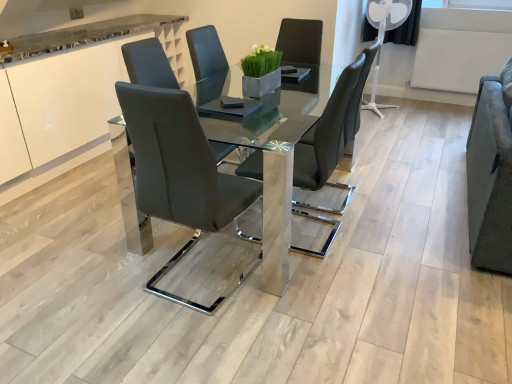
Question: Which is correct: white glossy cabinet at upper left is inside matte black chair at center, placed as the 1th chair when sorted from right to left, or outside of it?

Choices:
 (A) outside
 (B) inside

Answer: (A)

Question: In terms of width, does white glossy cabinet at upper left look wider or thinner when compared to matte black chair at center, which is the 2th chair from left to right?

Choices:
 (A) wide
 (B) thin

Answer: (A)

Question: Which is nearer to the matte black chair at center, placed as the 1th chair when sorted from right to left?

Choices:
 (A) white glossy cabinet at upper left
 (B) matte black chair at center, the 2th chair viewed from the right
 (C) velvet grey armchair at right

Answer: (B)

Question: Estimate the real-world distances between objects in this image. Which object is closer to the white glossy cabinet at upper left?

Choices:
 (A) matte black chair at center, placed as the 1th chair when sorted from right to left
 (B) matte black chair at center, the 2th chair viewed from the right
 (C) velvet grey armchair at right

Answer: (B)